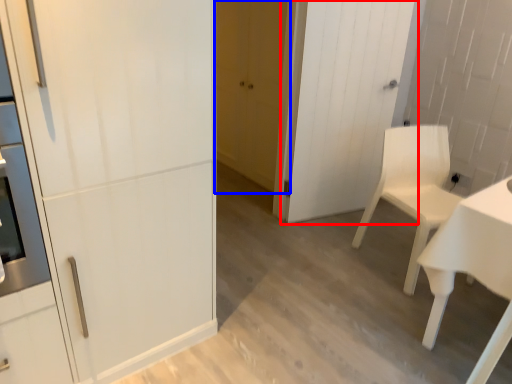
Question: Which point is closer to the camera, door (highlighted by a red box) or door (highlighted by a blue box)?

Choices:
 (A) door
 (B) door

Answer: (A)